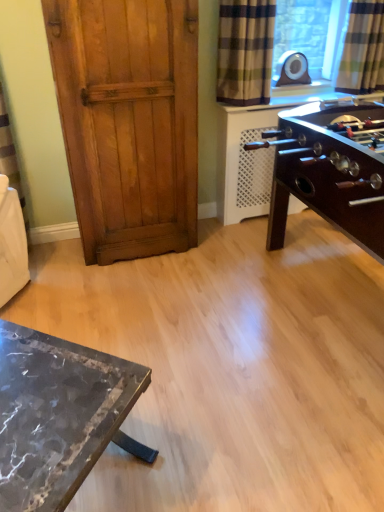
Question: Does point (364, 50) appear closer or farther from the camera than point (291, 72)?

Choices:
 (A) farther
 (B) closer

Answer: (B)

Question: From the image's perspective, is checkered fabric curtain at upper right, which appears as the 1th curtain when viewed from the right, above or below matte black speaker at upper right?

Choices:
 (A) below
 (B) above

Answer: (B)

Question: Considering the real-world distances, which object is closest to the checkered fabric curtain at upper right, the second curtain in the left-to-right sequence?

Choices:
 (A) matte black speaker at upper right
 (B) wooden door at left
 (C) plaid fabric curtain at upper right, which is the 1th curtain in left-to-right order
 (D) marble table at lower left

Answer: (A)

Question: Based on their relative distances, which object is nearer to the wooden door at left?

Choices:
 (A) plaid fabric curtain at upper right, the second curtain in the right-to-left sequence
 (B) checkered fabric curtain at upper right, which appears as the 1th curtain when viewed from the right
 (C) matte black speaker at upper right
 (D) marble table at lower left

Answer: (A)